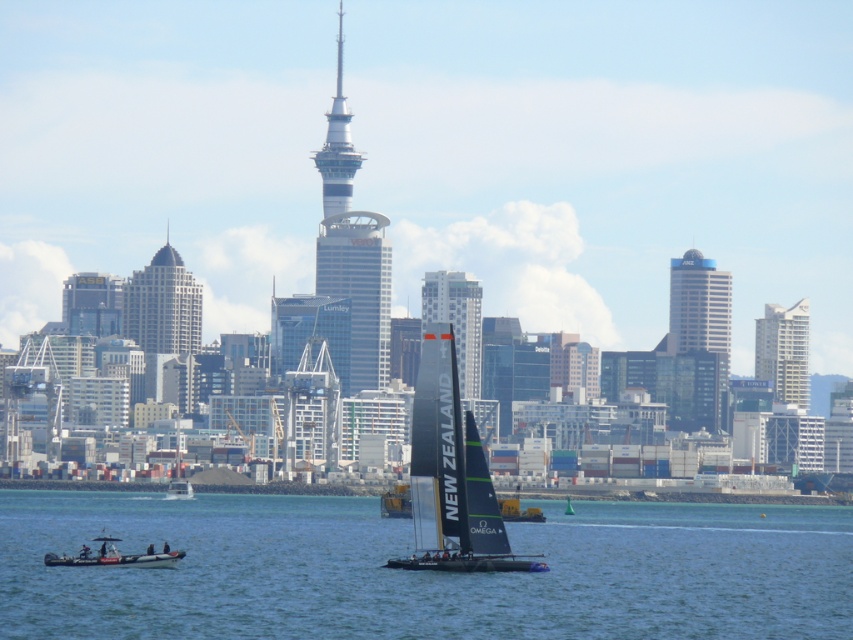
You are an architect designing a new structure that needs to be placed between the white glass building at upper right and the silver metallic tower at center. Considering their widths, which existing structure should your new building be wider than to maintain visual harmony?

The white glass building at upper right is wider than the silver metallic tower at center. To maintain visual harmony, your new building should be wider than the silver metallic tower at center but not necessarily wider than the white glass building at upper right.

You are a drone operator trying to capture a photo of the glassy blue skyscraper at center from above. Given the current position of the drone at point A, which is at coordinates 0.3, 0.3, can you determine if the skyscraper is within the drone camera field of view? The camera has a 45 degree angle of view. Please explain your reasoning based on the coordinates provided.

The glassy blue skyscraper at center is located at point (358, 289). The drone is at point A, coordinates (254, 192). The distance between the two points can be calculated using the Pythagorean theorem. The horizontal distance is 0.453 minus 0.3 equals 0.153 units. The vertical distance is 0.422 minus 0.3 equals 0.122 units. The angle of view is 45 degrees, so the maximum distance where the skyscraper would be in view is when the horizontal and vertical distances are equal. Since 0.153 is greater than 0.122